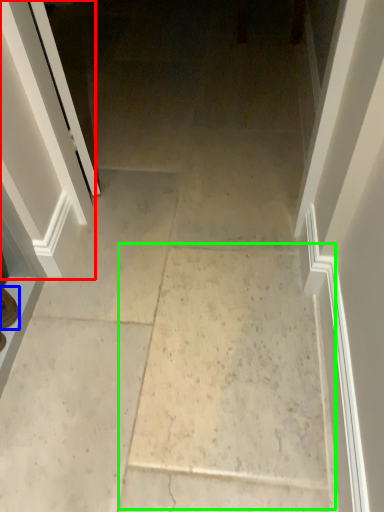
Question: Based on their relative distances, which object is farther from screen door (highlighted by a red box)? Choose from footwear (highlighted by a blue box) and concrete (highlighted by a green box).

Choices:
 (A) footwear
 (B) concrete

Answer: (B)